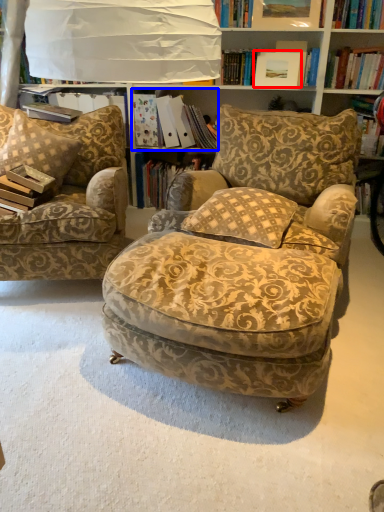
Question: Among these objects, which one is nearest to the camera, picture frame (highlighted by a red box) or book (highlighted by a blue box)?

Choices:
 (A) picture frame
 (B) book

Answer: (A)